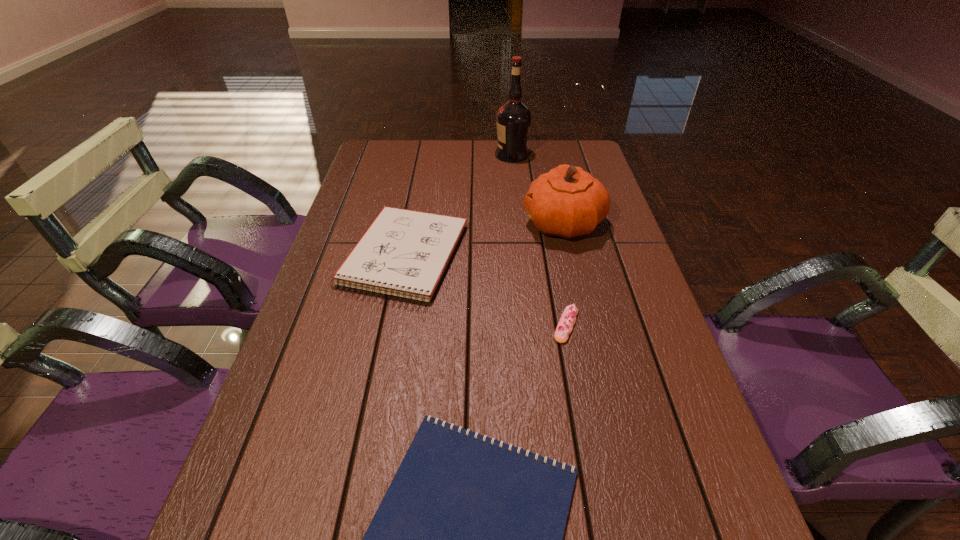
Where is `the farthest object`? The image size is (960, 540). the farthest object is located at coordinates (513, 119).

Image resolution: width=960 pixels, height=540 pixels. I want to click on the tallest object, so click(x=513, y=119).

Locate an element on the screen. Image resolution: width=960 pixels, height=540 pixels. pumpkin is located at coordinates (566, 202).

Where is `the third tallest object`? The image size is (960, 540). the third tallest object is located at coordinates (404, 253).

Find the location of a particular element. the farther notepad is located at coordinates (404, 253).

This screenshot has width=960, height=540. I want to click on the fourth tallest object, so click(565, 325).

Find the location of `free space located 0.070m on the surface of the liquor`. free space located 0.070m on the surface of the liquor is located at coordinates (474, 155).

Identify the location of vacant space located on the surface of the liquor. pyautogui.click(x=395, y=155).

Locate an element on the screen. The height and width of the screenshot is (540, 960). blank space located 0.290m on the surface of the liquor is located at coordinates (412, 155).

Find the location of `vacant area situated 0.050m on the front-facing side of the fourth shortest object`. vacant area situated 0.050m on the front-facing side of the fourth shortest object is located at coordinates (504, 223).